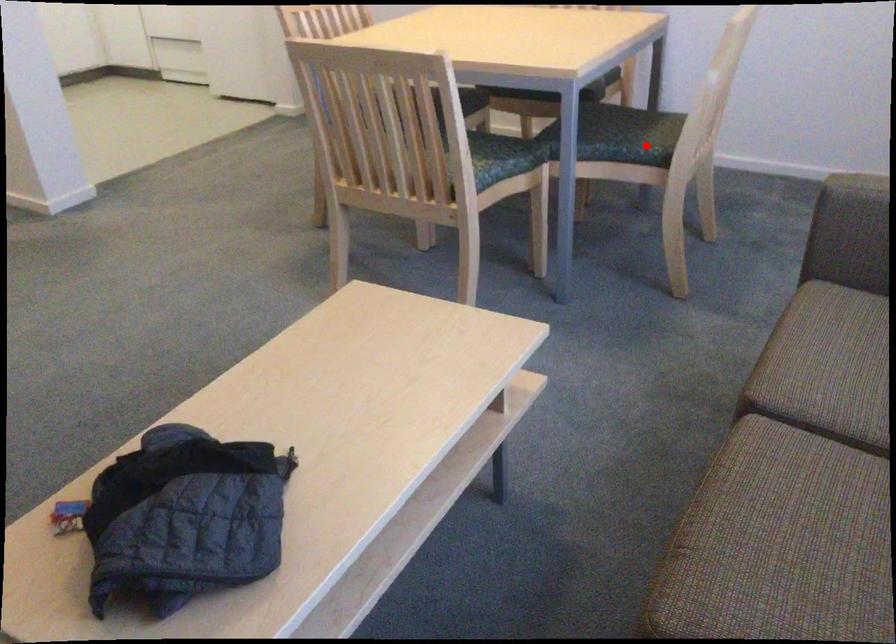
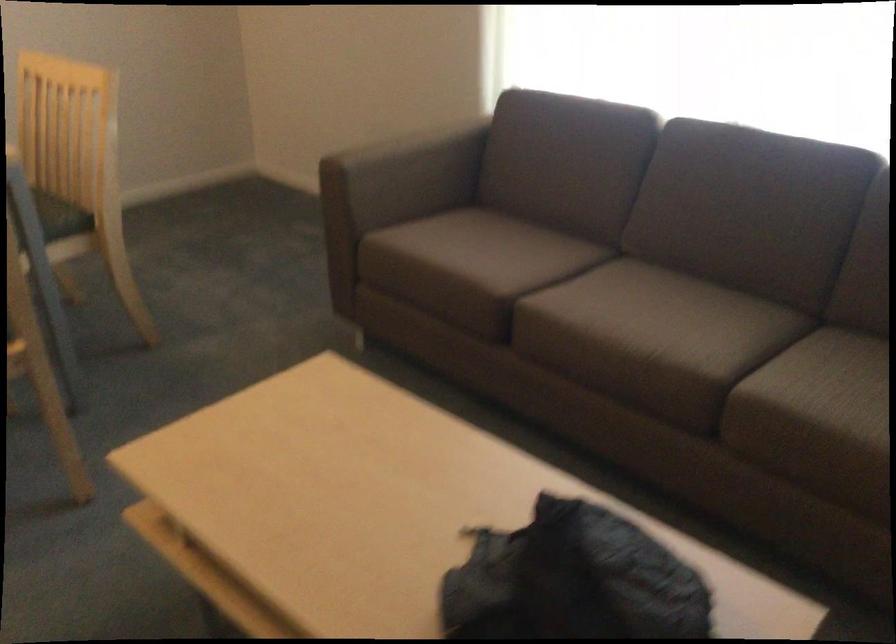
In the second image, find the point that corresponds to the highlighted location in the first image.

(61, 216)